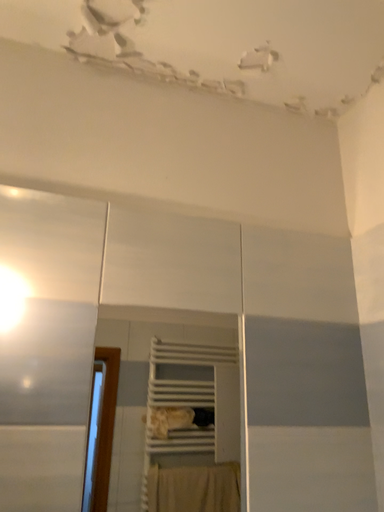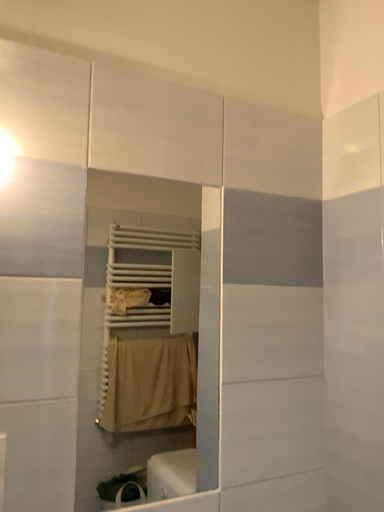
Question: Which way did the camera rotate in the video?

Choices:
 (A) rotated left
 (B) rotated right

Answer: (B)